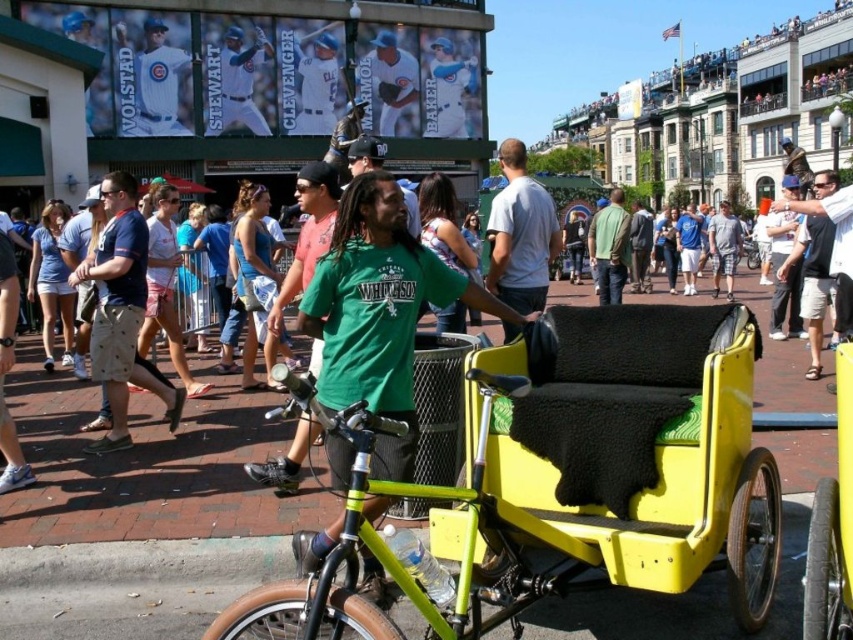
You are standing at the origin point in the image. There is a yellow matte rickshaw at center represented by point (575, 477). Can you determine the direction of the rickshaw relative to your position?

The yellow matte rickshaw at center is located at coordinates (575, 477), which places it to the right and above your current position at the origin point.

You are a photographer standing at the scene wanting to take a photo of the green cotton shirt at center and the yellow matte rickshaw at center. Based on their positions, which object should you focus on first to ensure both are in frame?

The yellow matte rickshaw at center is located below the green cotton shirt at center, so you should focus on the green cotton shirt at center first to ensure both are in frame.